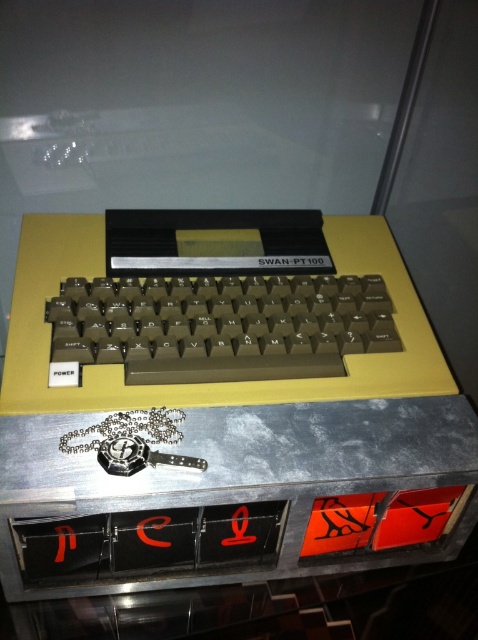
Question: Which of the following is the farthest from the observer?

Choices:
 (A) (131, 365)
 (B) (141, 413)

Answer: (A)

Question: Does metallic silver table at center have a lesser width compared to matte plastic keyboard at center?

Choices:
 (A) no
 (B) yes

Answer: (A)

Question: Which of the following is the farthest from the observer?

Choices:
 (A) (99, 312)
 (B) (460, 484)

Answer: (A)

Question: Which point is farther to the camera?

Choices:
 (A) metallic silver table at center
 (B) matte plastic keyboard at center

Answer: (B)

Question: Does metallic silver table at center have a lesser width compared to matte plastic keyboard at center?

Choices:
 (A) no
 (B) yes

Answer: (A)

Question: Does metallic silver table at center appear under matte plastic keyboard at center?

Choices:
 (A) no
 (B) yes

Answer: (B)